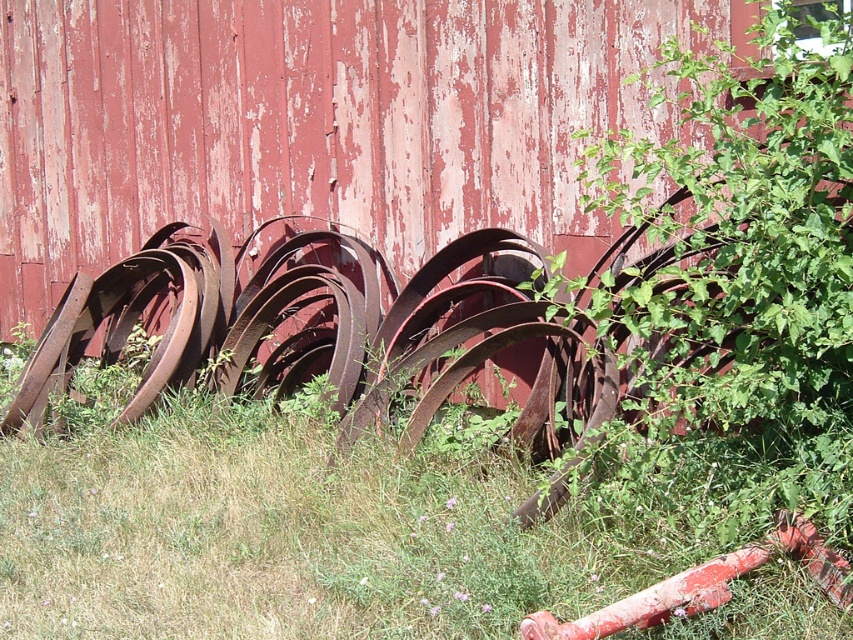
Looking at this image, you are a gardener who wants to plant a new flower in the ground. You see the green grass at lower left and the green leafy plant at right. Which area would you choose to plant the flower, and why?

You should plant the flower in the area with the green leafy plant at right because it is taller than the green grass at lower left, indicating better soil quality and more nutrients for the flower to grow.

You are standing in front of the red wooden wall with peeling paint. There is a point marked at coordinates (x=294, y=531). What is located at that point?

The point at coordinates (x=294, y=531) corresponds to green grass at lower left.

You are a gardener who wants to plant a new flower in the area with the most space. Based on the scene, which location would you choose between the green grass at lower left and the green leafy plant at right?

The green grass at lower left might be wider than green leafy plant at right, so the gardener should choose the area with the green grass at lower left for planting the new flower as it likely has more space.